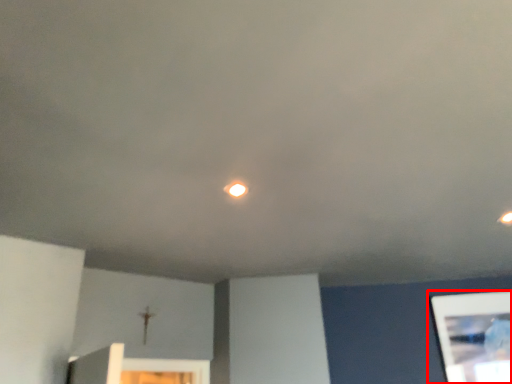
Question: Where is picture frame (annotated by the red box) located in relation to light in the image?

Choices:
 (A) left
 (B) right

Answer: (B)